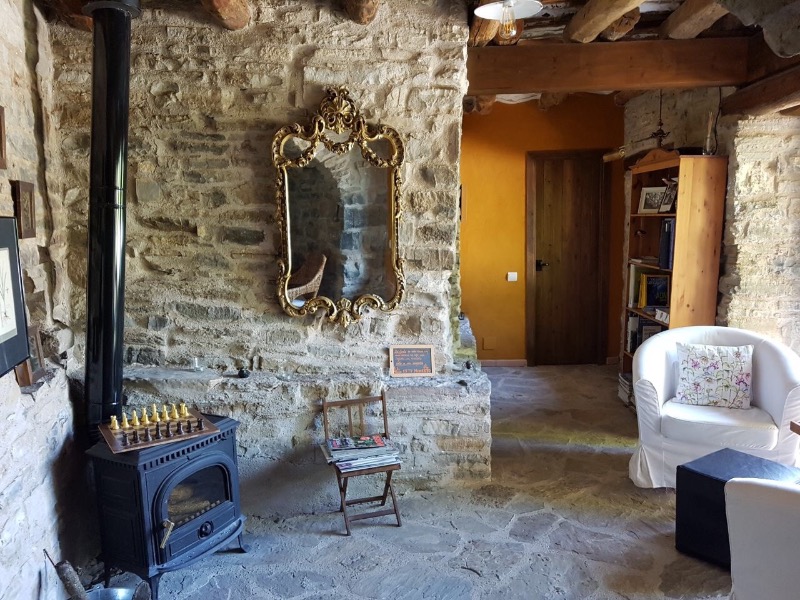
Find the location of a particular element. mustard yellow back wall is located at coordinates (492, 320), (492, 239), (500, 142), (589, 127).